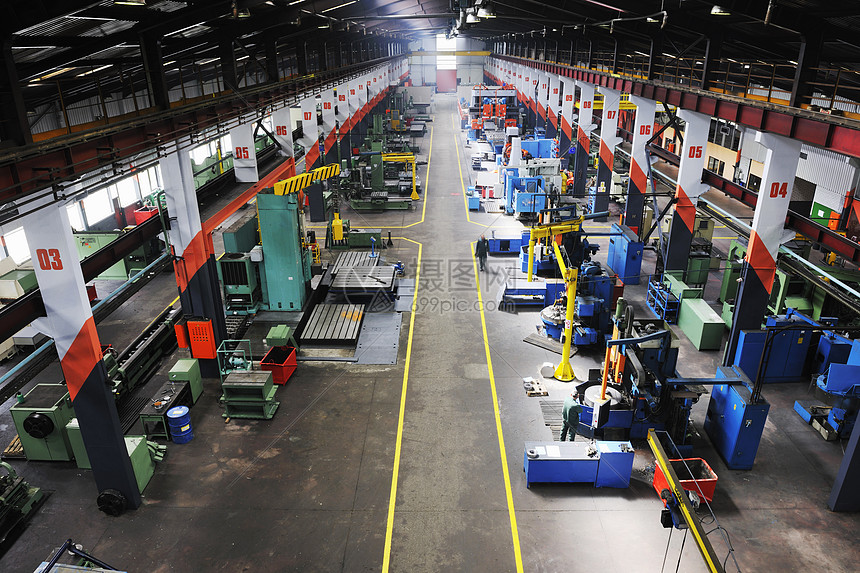
The height and width of the screenshot is (573, 860). I want to click on ceiling, so click(433, 21).